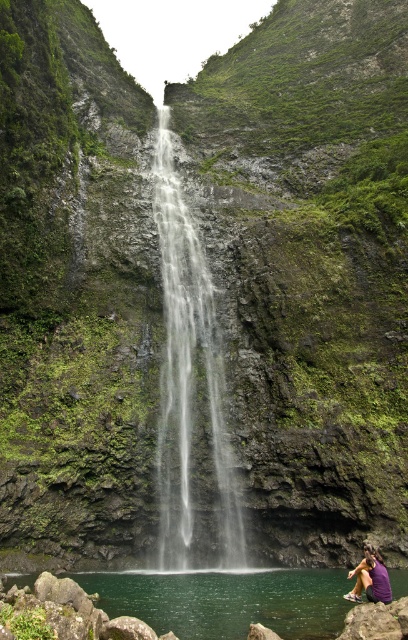
Question: Where is clear water at center located in relation to green liquid water at lower center in the image?

Choices:
 (A) left
 (B) right

Answer: (A)

Question: Does clear water at center have a greater width compared to purple fabric at lower right?

Choices:
 (A) yes
 (B) no

Answer: (A)

Question: Can you confirm if green liquid water at lower center is positioned to the right of purple fabric at lower right?

Choices:
 (A) yes
 (B) no

Answer: (B)

Question: Based on their relative distances, which object is nearer to the clear water at center?

Choices:
 (A) purple fabric at lower right
 (B) green liquid water at lower center

Answer: (B)

Question: Which point is closer to the camera?

Choices:
 (A) green liquid water at lower center
 (B) clear water at center

Answer: (A)

Question: Which object appears closest to the camera in this image?

Choices:
 (A) clear water at center
 (B) green liquid water at lower center

Answer: (B)